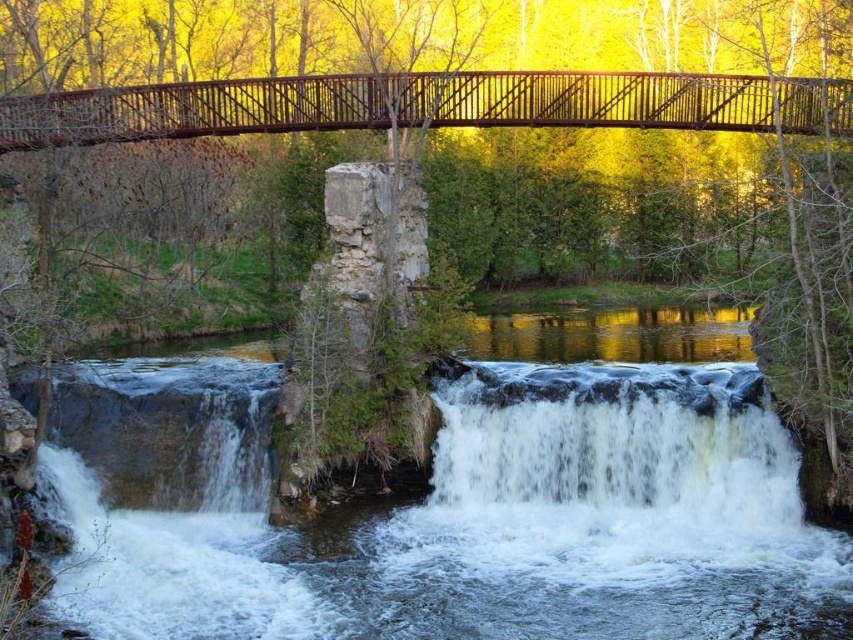
Question: Is smooth stone waterfall at center positioned behind rusty metal bridge at upper center?

Choices:
 (A) yes
 (B) no

Answer: (B)

Question: Among these points, which one is nearest to the camera?

Choices:
 (A) [770, 436]
 (B) [647, 614]

Answer: (B)

Question: Which of the following is the closest to the observer?

Choices:
 (A) (158, 84)
 (B) (631, 378)

Answer: (B)

Question: Is white frothy water at center to the left of rusty metal bridge at upper center from the viewer's perspective?

Choices:
 (A) yes
 (B) no

Answer: (B)

Question: Considering the relative positions of smooth stone waterfall at center and white frothy water at center in the image provided, where is smooth stone waterfall at center located with respect to white frothy water at center?

Choices:
 (A) right
 (B) left

Answer: (B)

Question: Which point is farther to the camera?

Choices:
 (A) rusty metal bridge at upper center
 (B) white frothy water at center

Answer: (B)